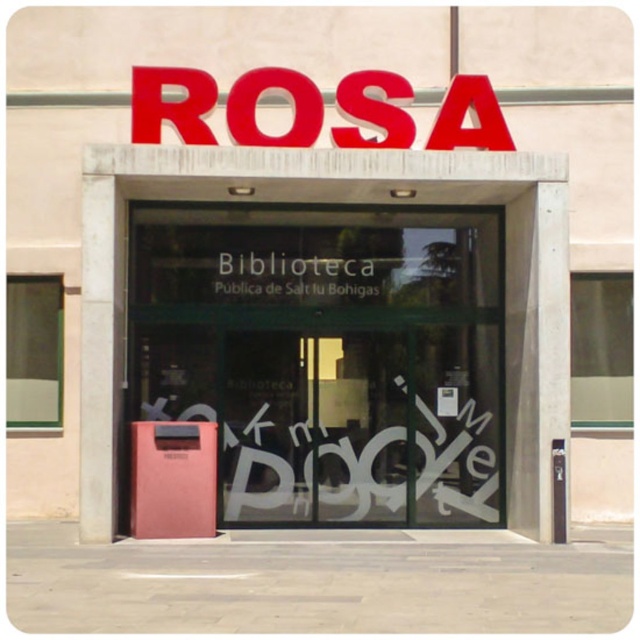
Is pink matte trash can at center smaller than black glass sign at center?

Incorrect, pink matte trash can at center is not smaller in size than black glass sign at center.

How far apart are pink matte trash can at center and black glass sign at center?

The distance of pink matte trash can at center from black glass sign at center is 71.94 centimeters.

Where is `pink matte trash can at center`? The image size is (640, 640). pink matte trash can at center is located at coordinates (326, 356).